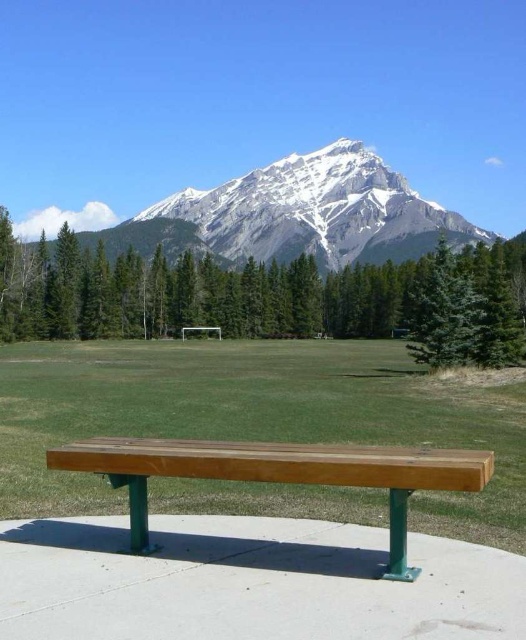
You are planning to set up a picnic in the area. Considering the space available, which object between the green grass at center and the green textured tree at upper center would allow more room for your picnic setup?

The green textured tree at upper center occupies more space than the green grass at center, so the picnic setup would have more room near the green textured tree at upper center.

You are standing at the point with coordinates (x=278, y=474) in the image. What object are you standing on?

The point (x=278, y=474) corresponds to the wooden bench at center, so you are standing on the wooden bench at center.

You are sitting on the wooden bench at center and want to look at the green textured tree at upper center. Which object is closer to your eyes?

The green textured tree at upper center is closer to your eyes than the wooden bench at center because it is positioned further to the viewer.